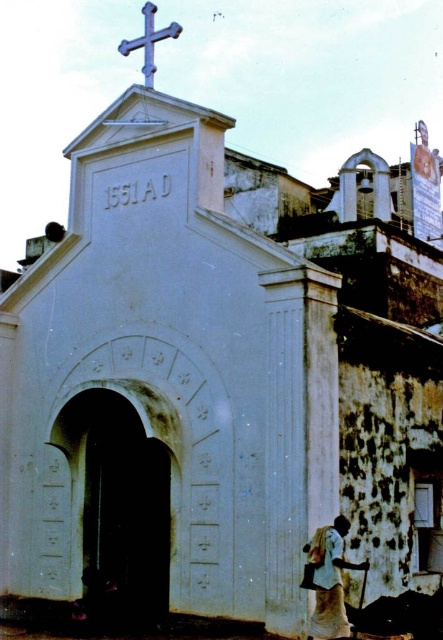
You are standing in front of the historical church structure. There is a white cloth at lower right. Where exactly is the white cloth positioned relative to the main entrance?

The white cloth at lower right is located at point [329,579], which is to the right and slightly below the main entrance of the church.

You are standing at the entrance of the historical church and want to take a photo of the two points mentioned. Which point, point (313, 612) or point (138, 38), is closer to you when facing the building?

Point (313, 612) is closer to you because it is in front of point (138, 38).